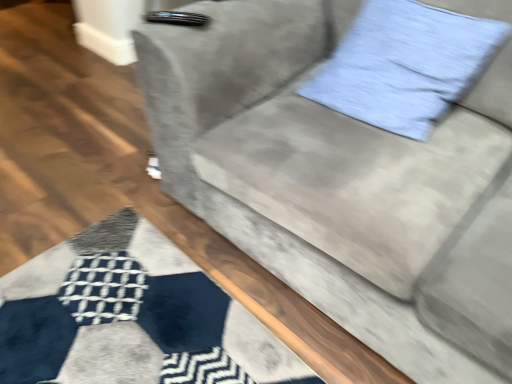
Question: Considering the positions of velvet gray couch at center and light blue fabric pillow at upper right in the image, is velvet gray couch at center wider or thinner than light blue fabric pillow at upper right?

Choices:
 (A) wide
 (B) thin

Answer: (A)

Question: Relative to light blue fabric pillow at upper right, is velvet gray couch at center in front or behind?

Choices:
 (A) behind
 (B) front

Answer: (B)

Question: From a real-world perspective, is velvet gray couch at center positioned above or below light blue fabric pillow at upper right?

Choices:
 (A) below
 (B) above

Answer: (A)

Question: From the image's perspective, is light blue fabric pillow at upper right located above or below velvet gray couch at center?

Choices:
 (A) below
 (B) above

Answer: (B)

Question: Do you think light blue fabric pillow at upper right is within velvet gray couch at center, or outside of it?

Choices:
 (A) inside
 (B) outside

Answer: (A)

Question: Based on their sizes in the image, would you say light blue fabric pillow at upper right is bigger or smaller than velvet gray couch at center?

Choices:
 (A) big
 (B) small

Answer: (B)

Question: Is point pos(494,49) positioned closer to the camera than point pos(449,147)?

Choices:
 (A) farther
 (B) closer

Answer: (A)